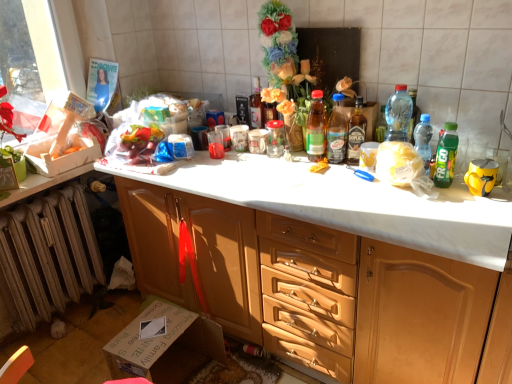
Where is `free point above rusty metal radiator at lower left (from a real-world perspective)`? The height and width of the screenshot is (384, 512). free point above rusty metal radiator at lower left (from a real-world perspective) is located at coordinates (36, 201).